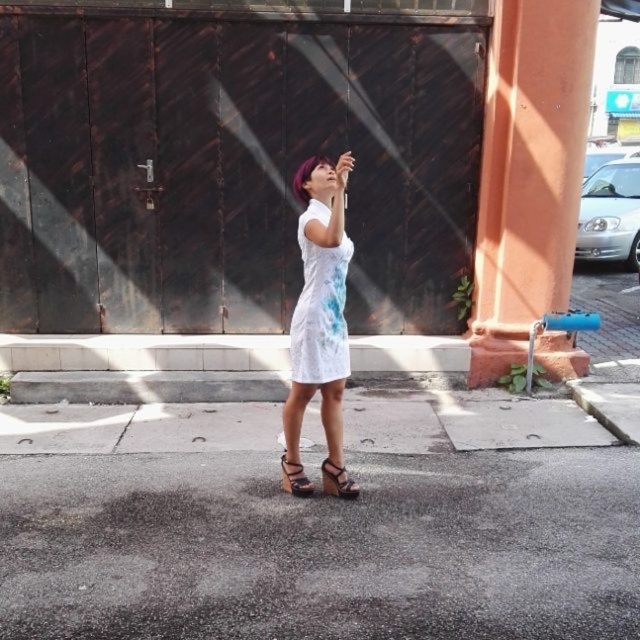
You are a delivery person who needs to place a package on the dark brown corrugated metal at center. The package has a corner at point [232,161]. Is the corner of the package on the dark brown corrugated metal at center?

Yes, the point [232,161] is on the dark brown corrugated metal at center, so the corner of the package is on the dark brown corrugated metal at center.

You are a delivery person with a box that is 2 feet wide. You need to walk through the space between the orange concrete pillar at right and the viewer. Can you pass through without tilting the box sideways?

The space between the orange concrete pillar at right and the viewer is 17.66 feet, which is wider than the 2 feet width of the box. Therefore, you can pass through without tilting the box sideways.

You are a painter who needs to paint both the dark brown corrugated metal at center and the orange concrete pillar at right. If you have enough paint to cover 10 square meters, which object should you paint first to ensure you have enough paint for both?

The dark brown corrugated metal at center has a larger width than the orange concrete pillar at right, so you should paint the orange concrete pillar at right first to ensure there is enough paint left for the larger dark brown corrugated metal at center.